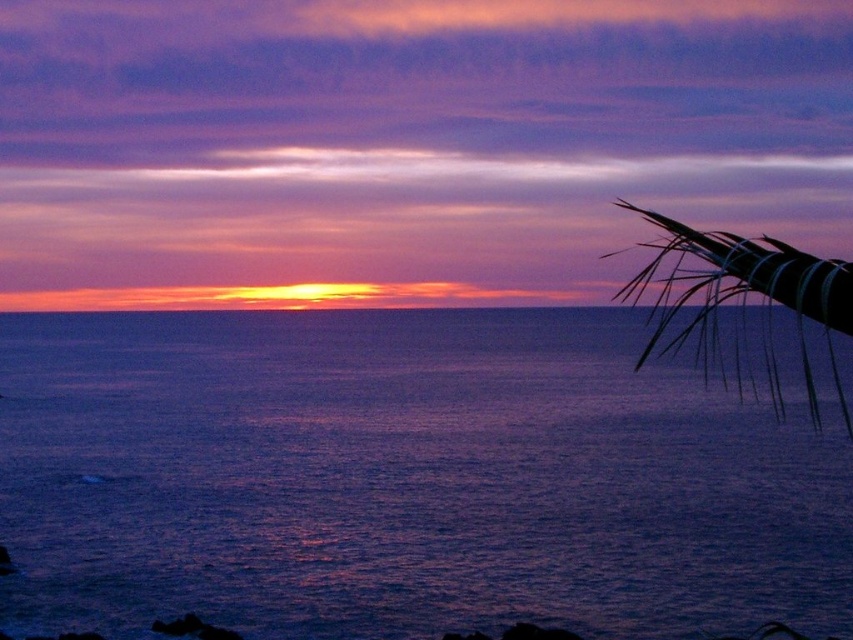
Between purple water at center and silvery metallic palm fronds at upper right, which one has less height?

With less height is purple water at center.

From the picture: Who is lower down, purple water at center or silvery metallic palm fronds at upper right?

purple water at center is lower down.

Describe the element at coordinates (402, 480) in the screenshot. This screenshot has height=640, width=853. I see `purple water at center` at that location.

The image size is (853, 640). I want to click on purple water at center, so click(x=402, y=480).